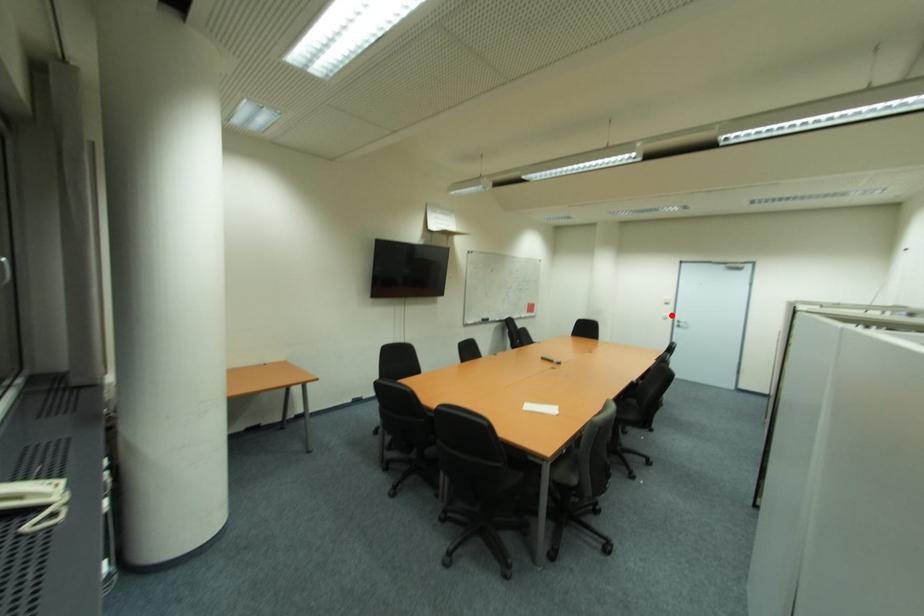
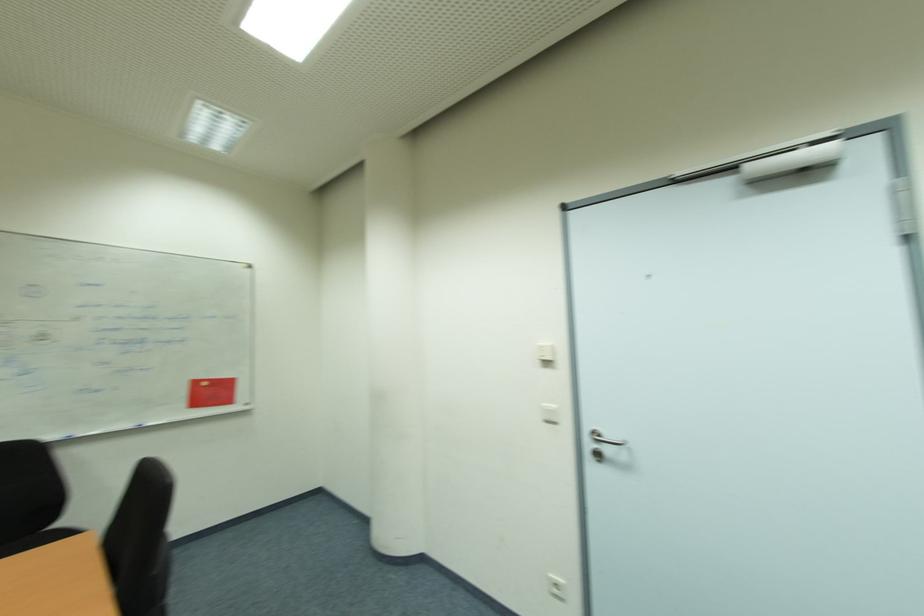
Question: I am providing you with two images of the same scene from different viewpoints. In image1, a red point is highlighted. Considering the same 3D point in image2, which of the following is correct?

Choices:
 (A) It is closer
 (B) It is farther

Answer: (B)